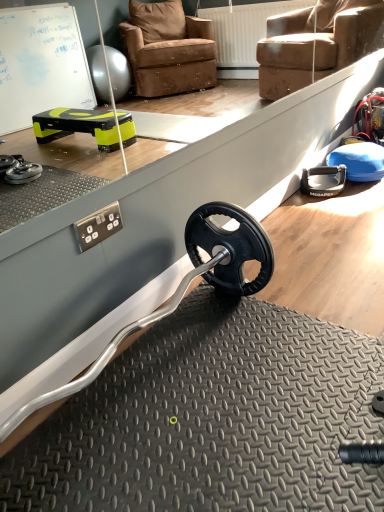
What is the approximate width of black rubber push-up at right?

black rubber push-up at right is 7.77 inches in width.

Image resolution: width=384 pixels, height=512 pixels. What are the coordinates of `black rubber push-up at right` in the screenshot? It's located at (323, 180).

Image resolution: width=384 pixels, height=512 pixels. What do you see at coordinates (323, 180) in the screenshot? I see `black rubber push-up at right` at bounding box center [323, 180].

The image size is (384, 512). I want to click on black rubber push-up at right, so click(323, 180).